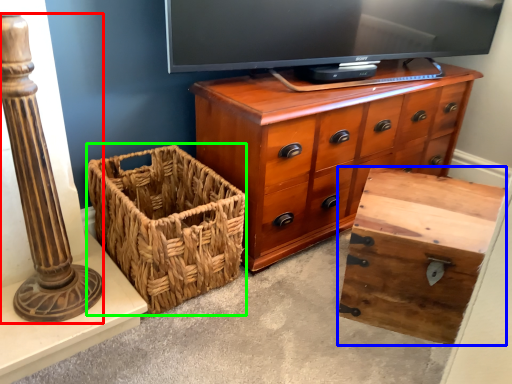
Question: Considering the real-world distances, which object is closest to pillar (highlighted by a red box)? storage box (highlighted by a blue box) or basket (highlighted by a green box).

Choices:
 (A) storage box
 (B) basket

Answer: (B)